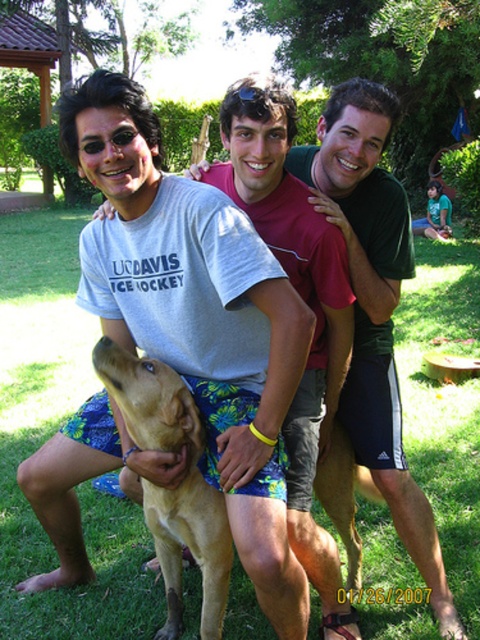
Between golden fur dog at center and blue plastic goggles at center, which one has more height?

With more height is golden fur dog at center.

Between golden fur dog at center and blue plastic goggles at center, which one appears on the right side from the viewer's perspective?

From the viewer's perspective, blue plastic goggles at center appears more on the right side.

Does point (190, 492) come closer to viewer compared to point (252, 93)?

No, it is behind (252, 93).

Find the location of `golden fur dog at center`. golden fur dog at center is located at coordinates (179, 484).

Is light brown fur dog at center wider than blue plastic goggles at center?

Indeed, light brown fur dog at center has a greater width compared to blue plastic goggles at center.

Is point (283, 365) positioned before point (238, 88)?

Yes, it is in front of point (238, 88).

This screenshot has width=480, height=640. Identify the location of light brown fur dog at center. (181, 268).

Find the location of a particular element. The width and height of the screenshot is (480, 640). light brown fur dog at center is located at coordinates (181, 268).

Does green grass at center have a lesser height compared to golden fur dog at center?

Incorrect, green grass at center's height does not fall short of golden fur dog at center's.

The image size is (480, 640). I want to click on green grass at center, so click(x=48, y=436).